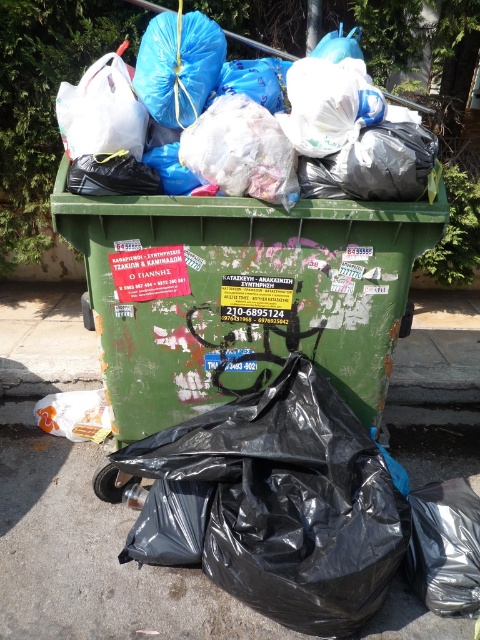
In the scene shown: Between green matte/recycled plastic recycling bin at center and white plastic bag at upper left, which one appears on the left side from the viewer's perspective?

From the viewer's perspective, white plastic bag at upper left appears more on the left side.

Who is more forward, (228, 364) or (101, 84)?

Positioned in front is point (101, 84).

Between point (361, 310) and point (99, 90), which one is positioned in front?

Positioned in front is point (99, 90).

The height and width of the screenshot is (640, 480). Find the location of `green matte/recycled plastic recycling bin at center`. green matte/recycled plastic recycling bin at center is located at coordinates pyautogui.click(x=241, y=296).

Who is more distant from viewer, (207, 216) or (85, 524)?

The point (85, 524) is behind.

Looking at this image, can you confirm if green matte/recycled plastic recycling bin at center is smaller than gray concrete pavement at lower center?

Yes, green matte/recycled plastic recycling bin at center is smaller than gray concrete pavement at lower center.

Does point (95, 324) come closer to viewer compared to point (8, 605)?

No, it is not.

In order to click on green matte/recycled plastic recycling bin at center in this screenshot , I will do `click(241, 296)`.

Between point (226, 252) and point (215, 113), which one is positioned in front?

Positioned in front is point (215, 113).

Find the location of a particular element. green matte/recycled plastic recycling bin at center is located at coordinates (241, 296).

Does point (333, 250) come farther from viewer compared to point (344, 120)?

Yes, point (333, 250) is behind point (344, 120).

What are the coordinates of `green matte/recycled plastic recycling bin at center` in the screenshot? It's located at (241, 296).